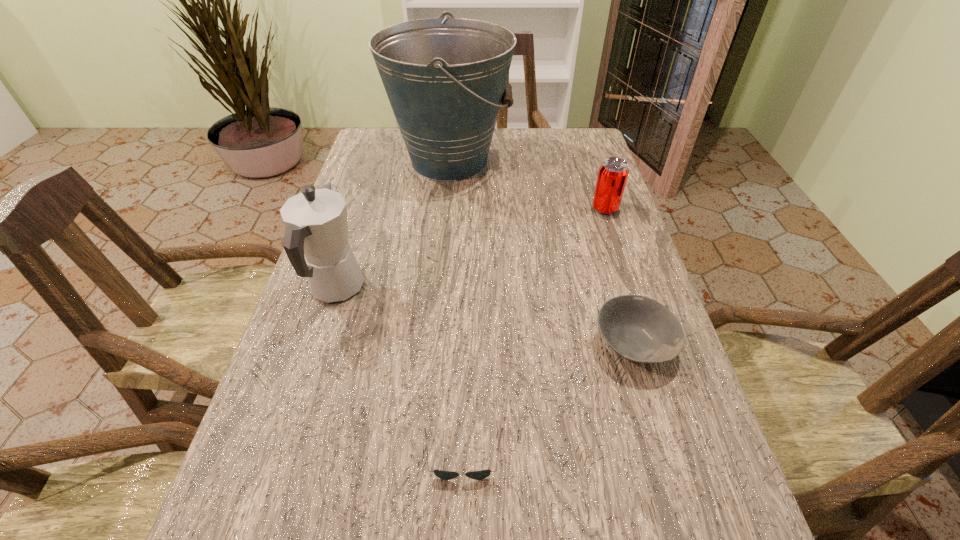
The height and width of the screenshot is (540, 960). I want to click on the tallest object, so click(445, 79).

You are a GUI agent. You are given a task and a screenshot of the screen. Output one action in this format:
    pyautogui.click(x=<x>, y=<y>)
    Task: Click on the farthest object
    
    Given the screenshot: What is the action you would take?
    pyautogui.click(x=445, y=79)

Where is `the fourth shortest object`? Image resolution: width=960 pixels, height=540 pixels. the fourth shortest object is located at coordinates (316, 242).

The image size is (960, 540). I want to click on the third tallest object, so pyautogui.click(x=613, y=173).

This screenshot has height=540, width=960. I want to click on soda can, so tap(613, 173).

Find the location of a particular element. This screenshot has width=960, height=540. the fourth tallest object is located at coordinates (639, 329).

In order to click on sunglasses in this screenshot , I will do `click(445, 475)`.

The width and height of the screenshot is (960, 540). Identify the location of the nearest object. (445, 475).

Locate an element on the screen. blank area located with the handle on opposite sides of the farthest object is located at coordinates (557, 161).

In order to click on free space located 0.270m on the back of the second tallest object in this screenshot , I will do `click(368, 192)`.